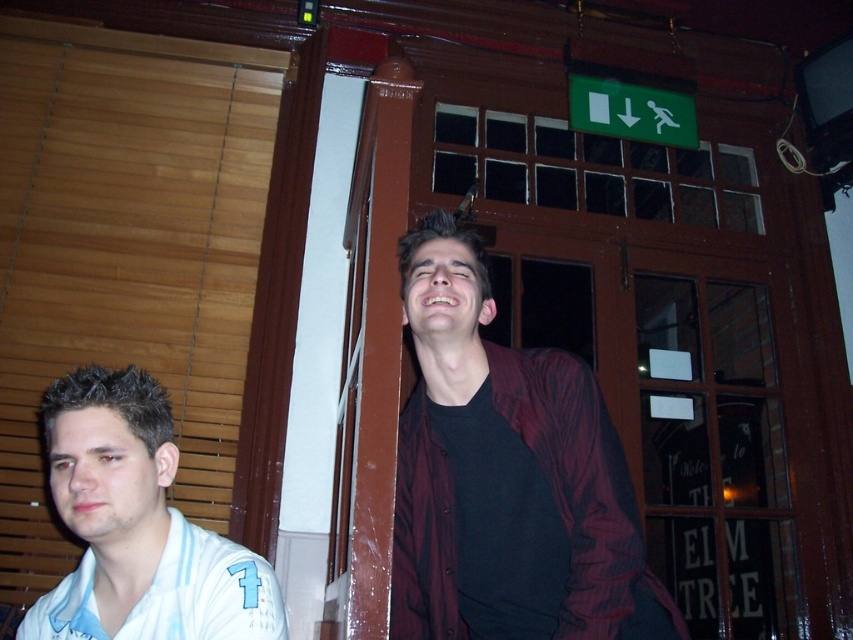
Question: Which object is farther from the camera taking this photo?

Choices:
 (A) white striped shirt at left
 (B) white jersey at left

Answer: (B)

Question: Does white striped shirt at left have a smaller size compared to white jersey at left?

Choices:
 (A) no
 (B) yes

Answer: (A)

Question: Does dark maroon jacket at center come in front of white jersey at left?

Choices:
 (A) yes
 (B) no

Answer: (A)

Question: Which point is closer to the camera?

Choices:
 (A) dark maroon jacket at center
 (B) white jersey at left

Answer: (A)

Question: Can you confirm if dark maroon jacket at center is bigger than white jersey at left?

Choices:
 (A) no
 (B) yes

Answer: (B)

Question: Which of the following is the farthest from the observer?

Choices:
 (A) white jersey at left
 (B) dark maroon jacket at center
 (C) white striped shirt at left

Answer: (A)